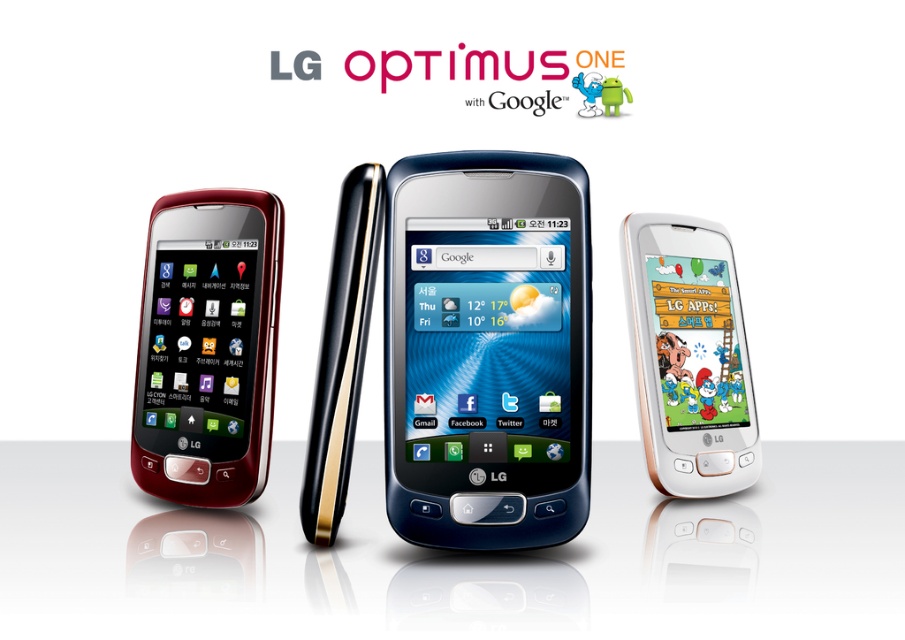
Can you confirm if matte black phone at left is wider than white glossy smartphone at center?

Yes.

Does point (177, 433) come closer to viewer compared to point (665, 474)?

No, it is not.

Image resolution: width=905 pixels, height=640 pixels. I want to click on matte black phone at left, so click(207, 346).

Is point (807, 476) more distant than point (664, 336)?

That is True.

Which of these two, matte black phone at center or white glossy smartphone at center, stands shorter?

matte black phone at center

Is point (203, 570) closer to viewer compared to point (670, 401)?

Yes.

You are a GUI agent. You are given a task and a screenshot of the screen. Output one action in this format:
    pyautogui.click(x=<x>, y=<y>)
    Task: Click on the matte black phone at center
    Image resolution: width=905 pixels, height=640 pixels.
    Given the screenshot: What is the action you would take?
    pyautogui.click(x=454, y=556)

Does metallic blue phone at center have a greater width compared to matte black phone at left?

No, metallic blue phone at center is not wider than matte black phone at left.

What do you see at coordinates (487, 349) in the screenshot? Image resolution: width=905 pixels, height=640 pixels. I see `metallic blue phone at center` at bounding box center [487, 349].

Identify the location of metallic blue phone at center. The height and width of the screenshot is (640, 905). (487, 349).